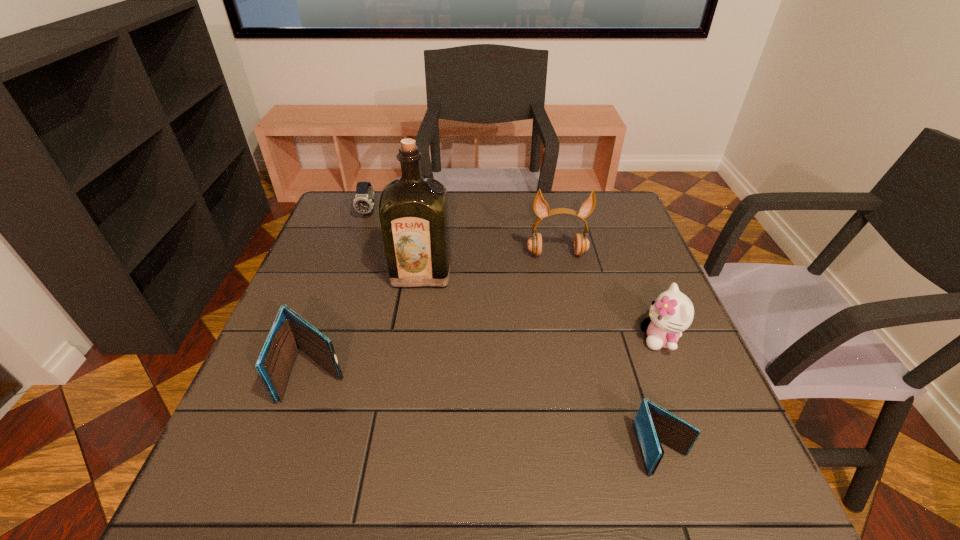
Locate an element on the screen. This screenshot has width=960, height=540. free region located 0.070m on the exterior surface of the taller wallet is located at coordinates (294, 439).

This screenshot has height=540, width=960. I want to click on vacant space situated 0.140m on the face of the watch, so click(356, 249).

Locate an element on the screen. This screenshot has height=540, width=960. vacant area located on the front-facing side of the second tallest object is located at coordinates (561, 274).

You are a GUI agent. You are given a task and a screenshot of the screen. Output one action in this format:
    pyautogui.click(x=<x>, y=<y>)
    Task: Click on the blank space located 0.150m on the front-facing side of the kitten
    Image resolution: width=960 pixels, height=540 pixels.
    Given the screenshot: What is the action you would take?
    pyautogui.click(x=573, y=339)

You are a GUI agent. You are given a task and a screenshot of the screen. Output one action in this format:
    pyautogui.click(x=<x>, y=<y>)
    Task: Click on the free point located on the front-facing side of the kitten
    This screenshot has width=960, height=540.
    Given the screenshot: What is the action you would take?
    pyautogui.click(x=538, y=339)

The height and width of the screenshot is (540, 960). I want to click on vacant space located on the front-facing side of the kitten, so click(x=573, y=339).

Locate an element on the screen. free space located on the label of the fourth object from right to left is located at coordinates (396, 438).

Identify the location of object at the far edge. (363, 202).

What are the coordinates of `object present at the near edge` in the screenshot? It's located at (653, 424).

The height and width of the screenshot is (540, 960). I want to click on wallet positioned at the left edge, so click(x=290, y=332).